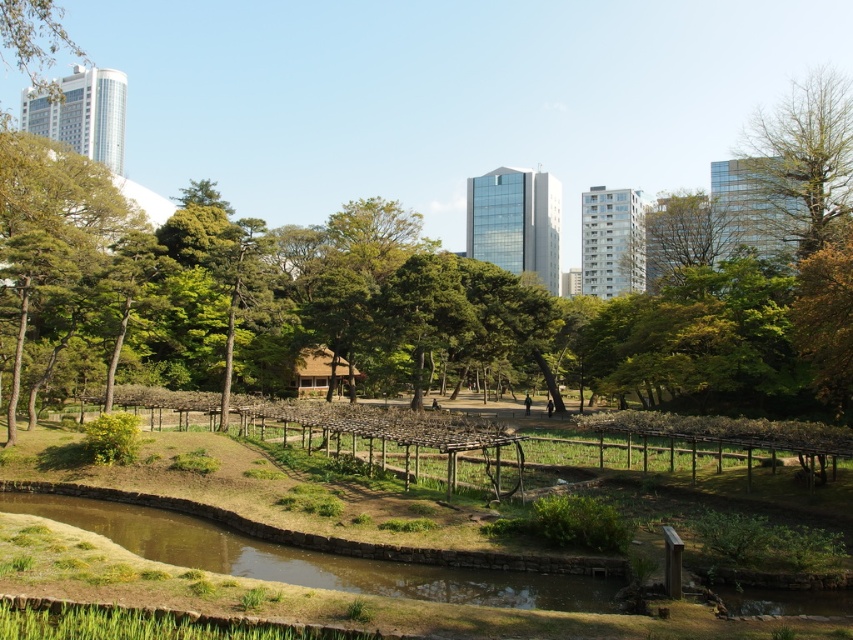
Question: Which point is farther to the camera?

Choices:
 (A) green leafy tree at upper center
 (B) green wooden trellis at center

Answer: (A)

Question: Does green wooden trellis at center have a larger size compared to bare wood tree at upper right?

Choices:
 (A) yes
 (B) no

Answer: (B)

Question: Can you confirm if green wooden trellis at center is positioned above green grassy river at center?

Choices:
 (A) no
 (B) yes

Answer: (B)

Question: Which of the following is the farthest from the observer?

Choices:
 (A) (161, 544)
 (B) (67, 588)

Answer: (A)

Question: Does green wooden trellis at center have a greater width compared to green grassy river at center?

Choices:
 (A) yes
 (B) no

Answer: (A)

Question: Which of the following is the farthest from the observer?

Choices:
 (A) (703, 237)
 (B) (170, 515)
 (C) (795, 160)
 (D) (625, 632)

Answer: (A)